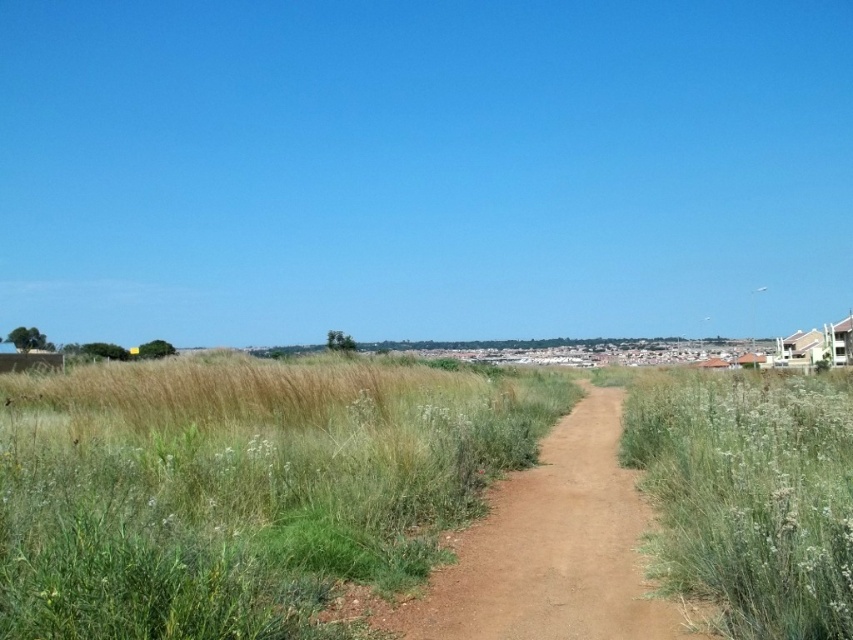
You are a gardener planning to install a sprinkler system to water both the green grassy at center and the green grassy at right. The sprinkler has a maximum range of 15 feet. Can you water both areas with a single sprinkler?

The green grassy at center is 16.67 feet from the green grassy at right. Since the sprinkler can only reach 15 feet, it cannot cover both areas simultaneously. You would need two separate sprinklers.

You are standing on the dirt path in the rural landscape. You notice two areas of green grassy at center and green grassy at right. Which of these two areas is positioned higher from the ground level?

The green grassy at center is located above green grassy at right, so it is higher from the ground level than the green grassy at right.

You are standing at the starting point of the dirt path in the rural landscape. You want to walk straight ahead towards the town in the distance. Will you step on the green grassy at center before reaching the town?

The green grassy at center is located at point (241, 486), which is along the path towards the town. Therefore, yes, you will step on the green grassy at center before reaching the town.